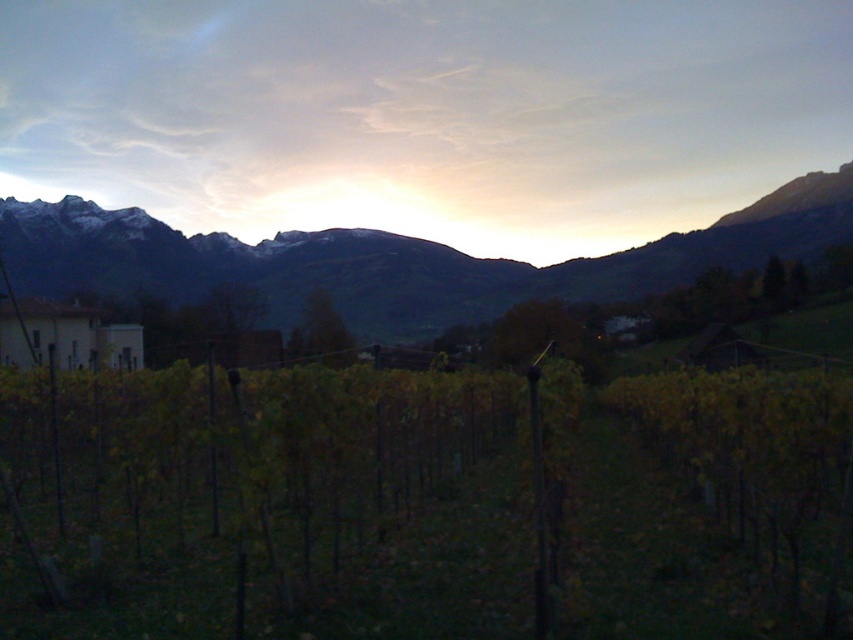
Question: Can you confirm if green leafy vineyard at center is positioned to the right of rocky brown mountain range at center?

Choices:
 (A) no
 (B) yes

Answer: (A)

Question: Which point appears closest to the camera in this image?

Choices:
 (A) (849, 513)
 (B) (357, 305)

Answer: (A)

Question: Does green leafy vineyard at center lie behind rocky brown mountain range at center?

Choices:
 (A) no
 (B) yes

Answer: (A)

Question: Which point is closer to the camera?

Choices:
 (A) (108, 269)
 (B) (223, 593)

Answer: (B)

Question: Does green leafy vineyard at center have a greater width compared to rocky brown mountain range at center?

Choices:
 (A) no
 (B) yes

Answer: (A)

Question: Which of the following is the farthest from the observer?

Choices:
 (A) rocky brown mountain range at center
 (B) green leafy vineyard at center

Answer: (A)